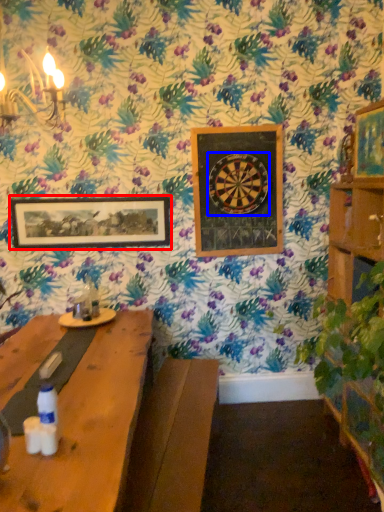
Question: Which point is closer to the camera, picture frame (highlighted by a red box) or design (highlighted by a blue box)?

Choices:
 (A) picture frame
 (B) design

Answer: (B)